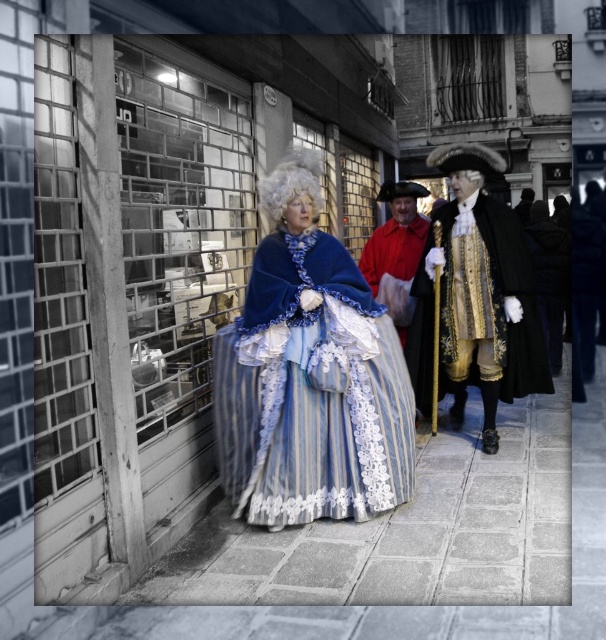
Question: In this image, where is velvet blue cape at center located relative to gold brocade coat at right?

Choices:
 (A) above
 (B) below

Answer: (B)

Question: Considering the real-world distances, which object is farthest from the red velvet coat at center?

Choices:
 (A) clear glass display case at center
 (B) smooth stone pavement at center

Answer: (B)

Question: Can you confirm if velvet blue cape at center is smaller than gold brocade coat at right?

Choices:
 (A) yes
 (B) no

Answer: (A)

Question: Estimate the real-world distances between objects in this image. Which object is farther from the clear glass display case at center?

Choices:
 (A) gold brocade coat at right
 (B) smooth stone pavement at center

Answer: (A)

Question: Among these points, which one is nearest to the camera?

Choices:
 (A) (310, 195)
 (B) (139, 404)
 (C) (413, 404)
 (D) (547, 442)

Answer: (B)

Question: Does clear glass display case at center have a greater width compared to red velvet coat at center?

Choices:
 (A) yes
 (B) no

Answer: (B)